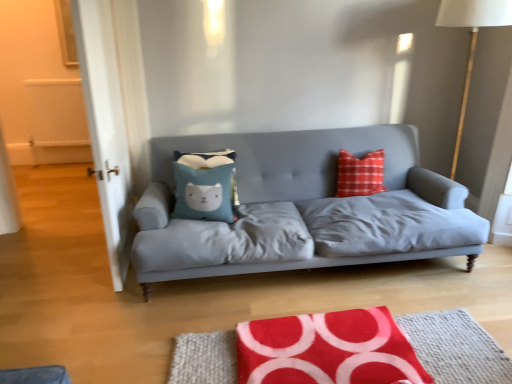
Question: Based on their sizes in the image, would you say red fabric rug at lower center is bigger or smaller than white fabric lampshade at right?

Choices:
 (A) small
 (B) big

Answer: (A)

Question: Does point (184, 344) appear closer or farther from the camera than point (467, 9)?

Choices:
 (A) farther
 (B) closer

Answer: (B)

Question: Which of these objects is positioned closest to the matte gray fabric couch at center?

Choices:
 (A) blue fabric pillow at center
 (B) white fabric lampshade at right
 (C) red fabric rug at lower center
 (D) transparent glass door at left

Answer: (A)

Question: Which object is the farthest from the red fabric rug at lower center?

Choices:
 (A) white fabric lampshade at right
 (B) matte gray fabric couch at center
 (C) blue fabric pillow at center
 (D) transparent glass door at left

Answer: (D)